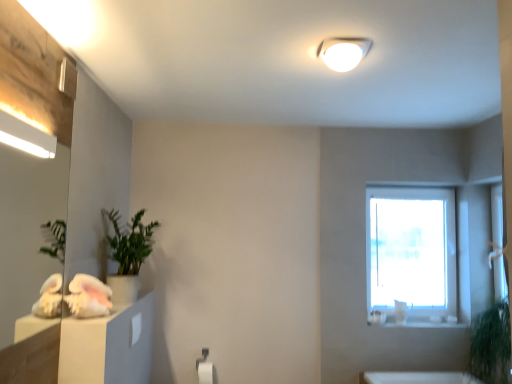
Question: Is matte wooden mirror at left bigger or smaller than green matte plant at left?

Choices:
 (A) small
 (B) big

Answer: (A)

Question: Considering the positions of point (72, 119) and point (114, 291), is point (72, 119) closer or farther from the camera than point (114, 291)?

Choices:
 (A) closer
 (B) farther

Answer: (A)

Question: Estimate the real-world distances between objects in this image. Which object is farther from the white matte toilet paper at lower center?

Choices:
 (A) green matte plant at left
 (B) matte white drawer at lower left
 (C) green leafy plant at lower right
 (D) matte wooden mirror at left
 (E) white glossy light fixture at upper center

Answer: (E)

Question: Based on their relative distances, which object is nearer to the matte white drawer at lower left?

Choices:
 (A) matte wooden mirror at left
 (B) white glossy light fixture at upper center
 (C) green leafy plant at lower right
 (D) white matte toilet paper at lower center
 (E) green matte plant at left

Answer: (E)